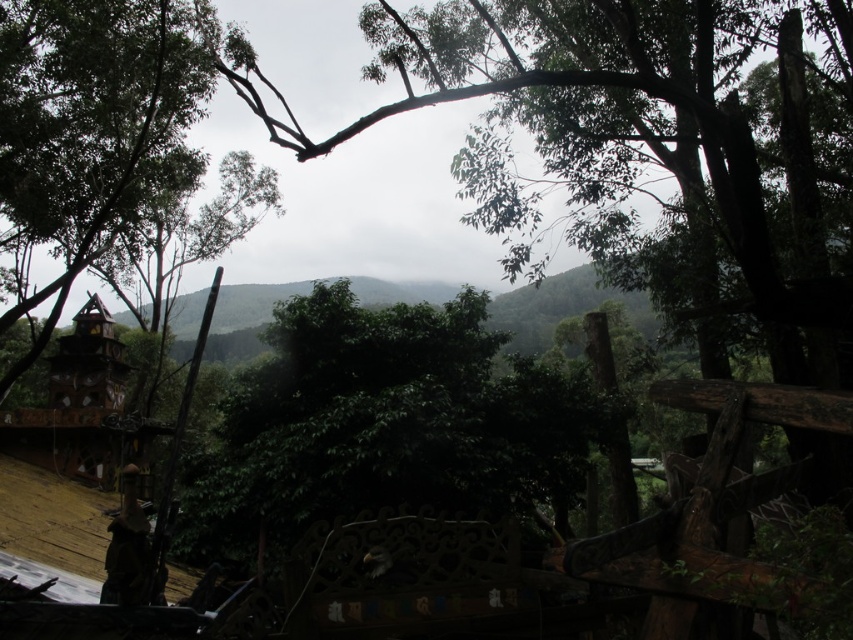
Question: Does green leafy tree at center appear on the right side of green matte tree at left?

Choices:
 (A) no
 (B) yes

Answer: (B)

Question: Among these points, which one is nearest to the camera?

Choices:
 (A) coord(0,92)
 (B) coord(271,339)

Answer: (B)

Question: Which object appears farthest from the camera in this image?

Choices:
 (A) green leafy tree at center
 (B) green matte tree at left

Answer: (A)

Question: Can you confirm if green leafy tree at center is positioned to the left of green matte tree at left?

Choices:
 (A) yes
 (B) no

Answer: (B)

Question: Observing the image, what is the correct spatial positioning of green leafy tree at center in reference to green matte tree at left?

Choices:
 (A) left
 (B) right

Answer: (B)